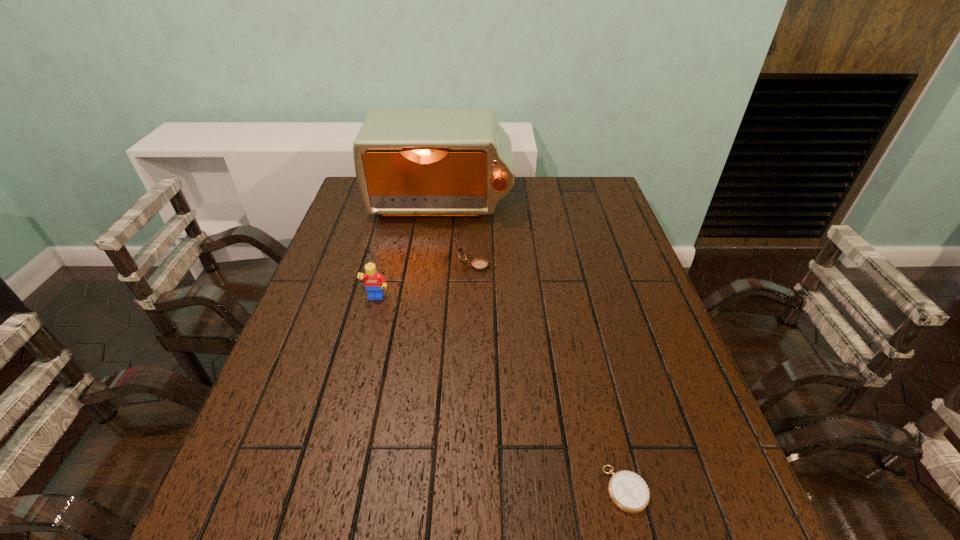
In order to click on toaster oven in this screenshot , I will do `click(458, 162)`.

This screenshot has width=960, height=540. What are the coordinates of `the farthest object` in the screenshot? It's located at (458, 162).

The image size is (960, 540). In order to click on Lego in this screenshot , I will do `click(374, 282)`.

Find the location of a particular element. Image resolution: width=960 pixels, height=540 pixels. the second tallest object is located at coordinates [374, 282].

This screenshot has width=960, height=540. In order to click on the taller compass in this screenshot , I will do `click(479, 265)`.

What are the coordinates of `the farther compass` in the screenshot? It's located at (479, 265).

Where is `the right compass`? the right compass is located at coordinates (628, 491).

At what (x,y) coordinates should I click in order to perform the action: click on the nearer compass. Please return your answer as a coordinate pair (x, y). Looking at the image, I should click on (628, 491).

Locate an element on the screen. This screenshot has width=960, height=540. blank area located 0.360m on the door side of the toaster oven is located at coordinates (427, 310).

Locate an element on the screen. Image resolution: width=960 pixels, height=540 pixels. free space located on the face of the Lego is located at coordinates (342, 434).